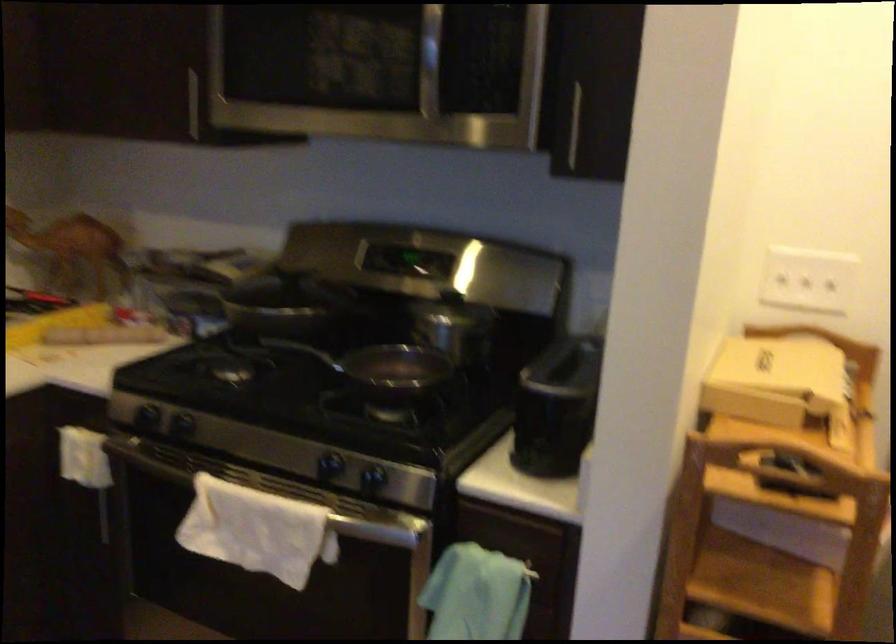
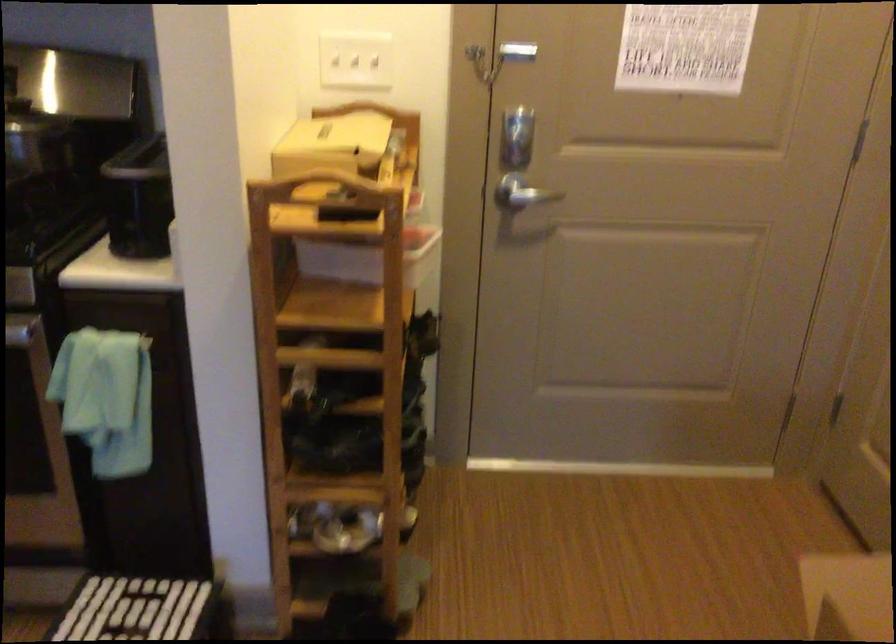
Find the pixel in the second image that matches point (805, 275) in the first image.

(356, 61)